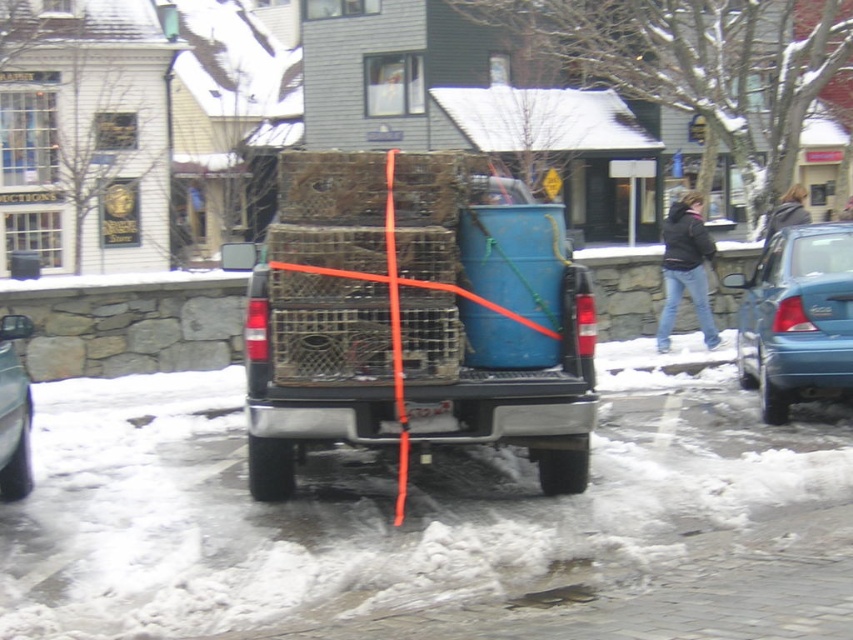
Question: Among these points, which one is nearest to the camera?

Choices:
 (A) (364, 163)
 (B) (785, 358)
 (C) (30, 481)

Answer: (A)

Question: From the image, what is the correct spatial relationship of wooden crates at center in relation to metallic silver car at left?

Choices:
 (A) below
 (B) above

Answer: (B)

Question: Is snowy asphalt at lower center further to camera compared to teal matte car at right?

Choices:
 (A) yes
 (B) no

Answer: (B)

Question: Which of the following is the farthest from the observer?

Choices:
 (A) (135, 464)
 (B) (463, 369)
 (C) (810, 244)

Answer: (C)

Question: From the image, what is the correct spatial relationship of snowy asphalt at lower center in relation to teal matte car at right?

Choices:
 (A) below
 (B) above

Answer: (A)

Question: Which point is farther to the camera?

Choices:
 (A) (421, 486)
 (B) (346, 244)
 (C) (781, 232)

Answer: (C)